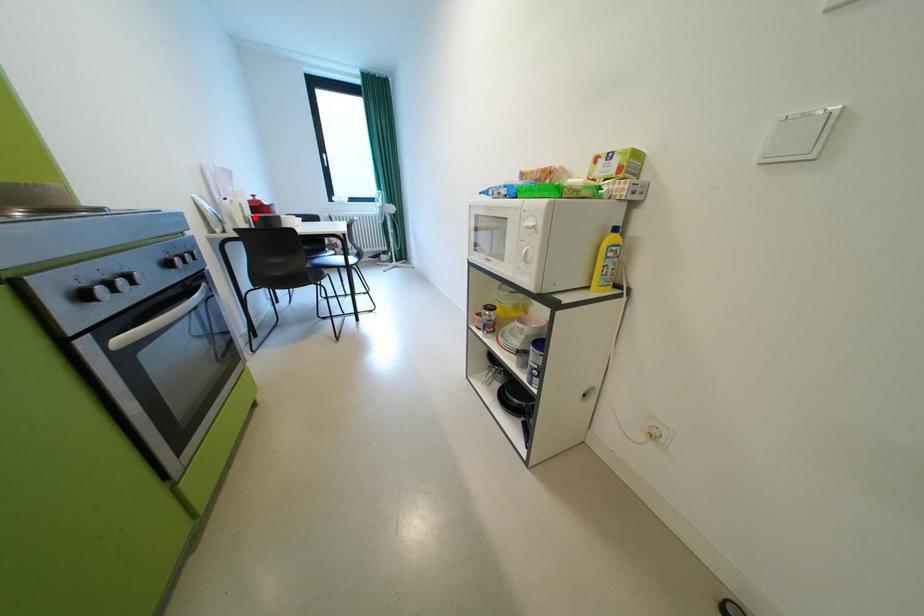
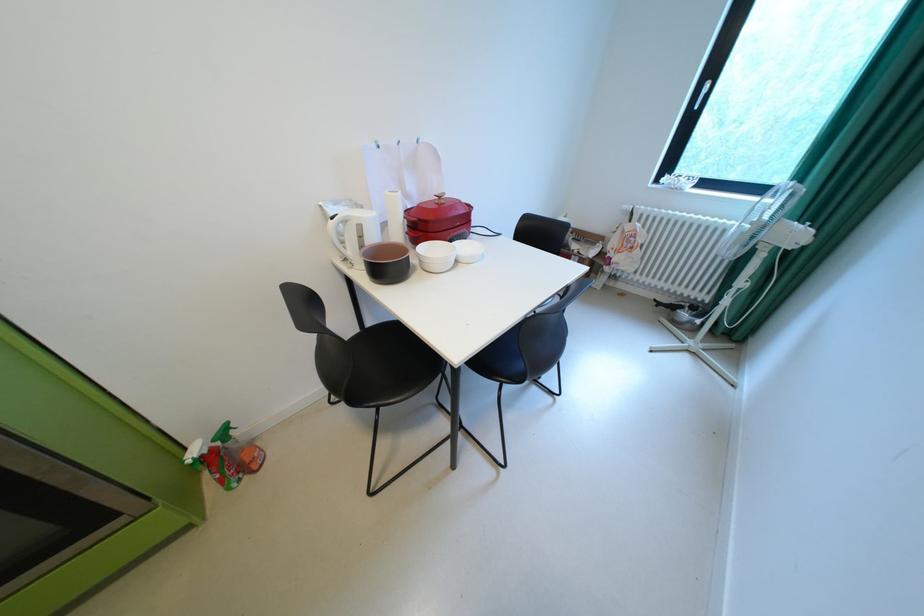
The point at the highlighted location is marked in the first image. Where is the corresponding point in the second image?

(371, 246)